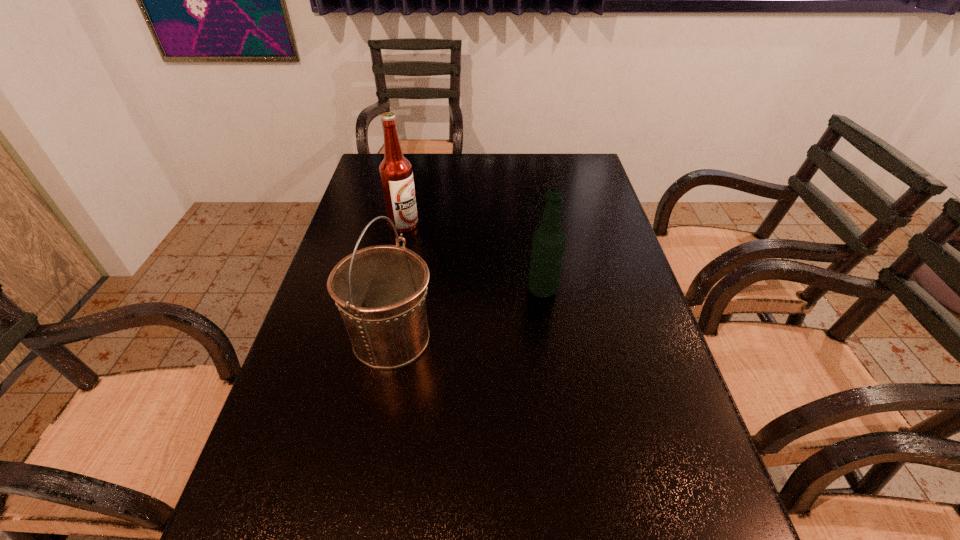
This screenshot has height=540, width=960. Identify the location of the farthest object. (396, 174).

Image resolution: width=960 pixels, height=540 pixels. Identify the location of the farther alcohol. (396, 174).

Identify the location of bucket. (380, 291).

Where is `the nearer alcohol`? the nearer alcohol is located at coordinates [548, 242].

Identify the location of the second nearest object. (548, 242).

You are a GUI agent. You are given a task and a screenshot of the screen. Output one action in this format:
    pyautogui.click(x=<x>, y=<y>)
    Task: Click on the free spot located on the label side of the left alcohol
    
    Given the screenshot: What is the action you would take?
    pyautogui.click(x=519, y=225)

The image size is (960, 540). Find the location of `blank space located on the back of the nearest object`. blank space located on the back of the nearest object is located at coordinates (403, 280).

Locate an element on the screen. vacant space located on the left of the second nearest object is located at coordinates (459, 291).

The height and width of the screenshot is (540, 960). I want to click on alcohol positioned at the left edge, so click(x=396, y=174).

This screenshot has height=540, width=960. Identify the location of bucket positioned at the left edge. (380, 291).